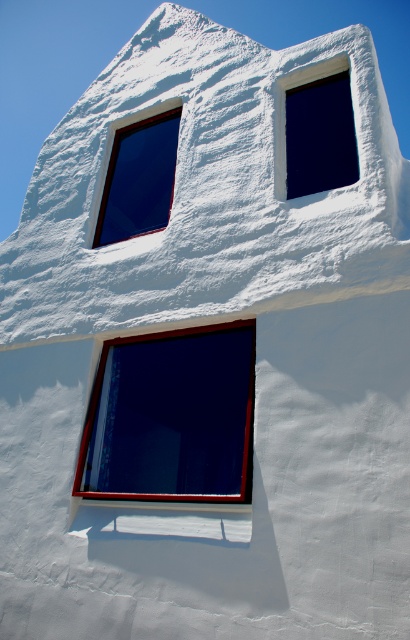
Question: Is matte black window at center below matte glass window at upper left?

Choices:
 (A) yes
 (B) no

Answer: (A)

Question: Which object appears closest to the camera in this image?

Choices:
 (A) matte glass window at upper right
 (B) matte black window at center
 (C) matte glass window at upper left

Answer: (B)

Question: Which object is closer to the camera taking this photo?

Choices:
 (A) matte glass window at upper right
 (B) matte black window at center

Answer: (B)

Question: Which of the following is the farthest from the observer?

Choices:
 (A) matte glass window at upper right
 (B) matte glass window at upper left

Answer: (B)

Question: Does matte black window at center appear over matte glass window at upper left?

Choices:
 (A) no
 (B) yes

Answer: (A)

Question: Can you confirm if matte glass window at upper right is positioned below matte glass window at upper left?

Choices:
 (A) yes
 (B) no

Answer: (B)